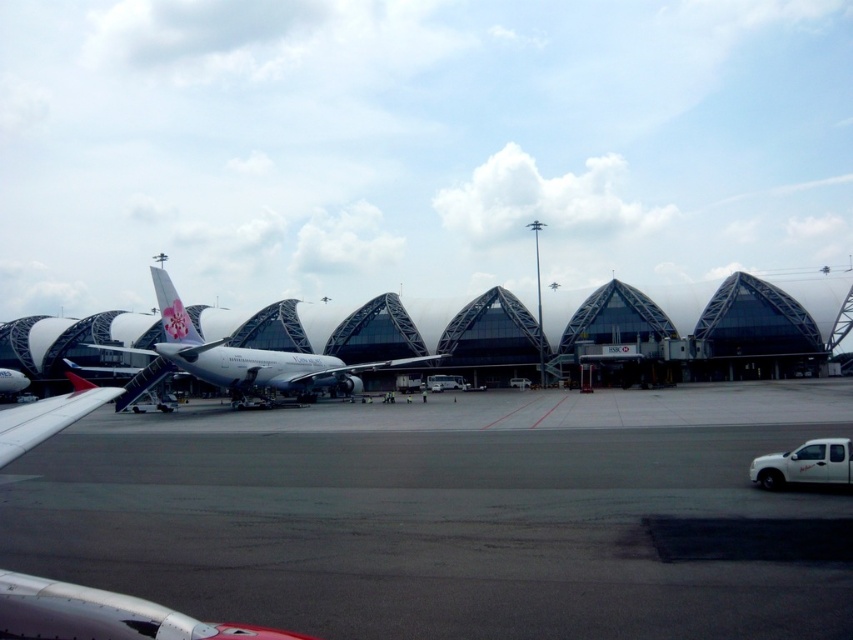
How far apart are white glossy airplane at left and white matte bus at center?

The distance of white glossy airplane at left from white matte bus at center is 47.58 meters.

Which is more to the right, white glossy airplane at left or white matte bus at center?

white matte bus at center is more to the right.

Identify the location of white glossy airplane at left. The width and height of the screenshot is (853, 640). (103, 614).

Where is `white glossy airplane at left`? The image size is (853, 640). white glossy airplane at left is located at coordinates (103, 614).

Is white matte car at center shorter than white matte truck at center?

→ No, white matte car at center is not shorter than white matte truck at center.

Is white matte car at center further to the viewer compared to white matte truck at center?

No.

Is point (144, 400) positioned after point (514, 378)?

No, (144, 400) is closer to viewer.

This screenshot has height=640, width=853. I want to click on white matte car at center, so click(x=154, y=401).

Is white matte truck at lower right to the left of white matte bus at center from the viewer's perspective?

Incorrect, white matte truck at lower right is not on the left side of white matte bus at center.

Is white matte truck at lower right behind white matte bus at center?

No, it is in front of white matte bus at center.

Where is `white matte truck at lower right`? white matte truck at lower right is located at coordinates (805, 465).

Where is `white matte truck at lower right`? The height and width of the screenshot is (640, 853). white matte truck at lower right is located at coordinates (805, 465).